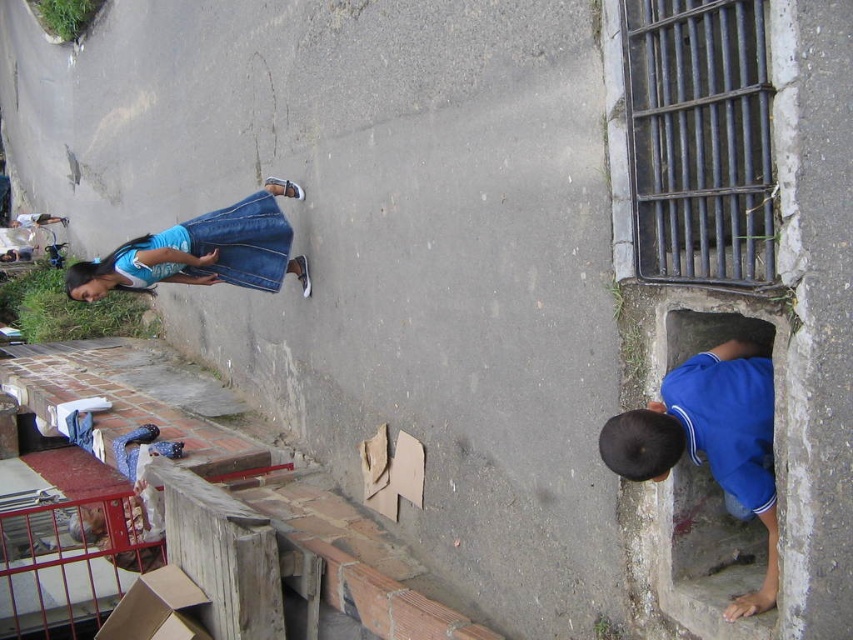
Question: Among these objects, which one is nearest to the camera?

Choices:
 (A) denim skirt at upper left
 (B) blue matte shirt at lower right

Answer: (B)

Question: Does blue matte shirt at lower right appear over denim skirt at upper left?

Choices:
 (A) yes
 (B) no

Answer: (B)

Question: Is blue matte shirt at lower right smaller than denim skirt at upper left?

Choices:
 (A) no
 (B) yes

Answer: (B)

Question: Does blue matte shirt at lower right have a greater width compared to denim skirt at upper left?

Choices:
 (A) yes
 (B) no

Answer: (B)

Question: Which of the following is the farthest from the observer?

Choices:
 (A) (192, 266)
 (B) (769, 596)

Answer: (A)